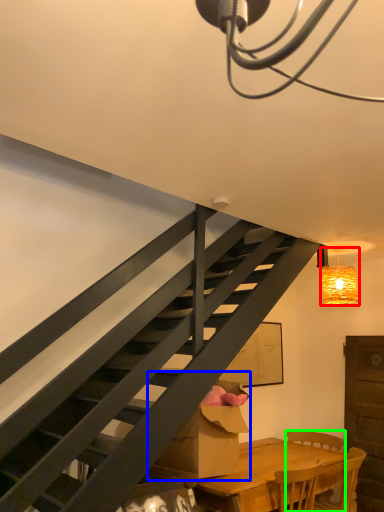
Question: Which is nearer to the lamp (highlighted by a red box)? cardboard box (highlighted by a blue box) or chair (highlighted by a green box).

Choices:
 (A) cardboard box
 (B) chair

Answer: (B)